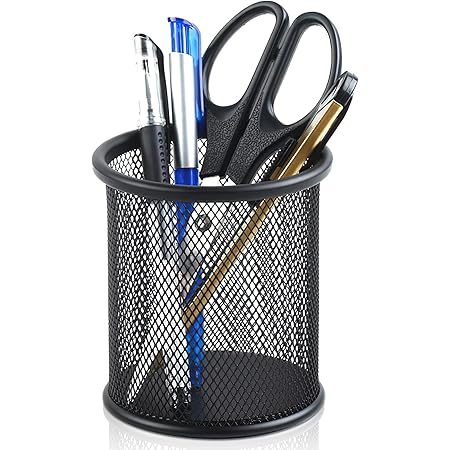
Find the location of a particular element. The image size is (450, 450). items in a pen holder is located at coordinates (162, 154), (184, 137), (229, 133), (300, 150).